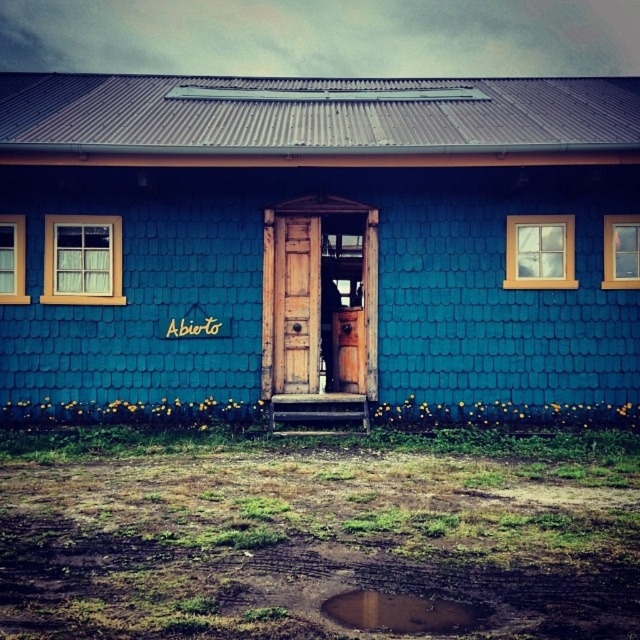
You are standing in front of the rustic building with the vibrant blue shingled exterior. You notice a wooden door at the center. Can you determine if the point at coordinates [324,300] is located on the wooden door at center?

The point at coordinates [324,300] is on the wooden door at center, so yes, the point is located on the wooden door at center.

You are a delivery person trying to enter the building through the wooden door at center. There is a brown mud puddle at lower center in your path. Can you step around it without getting your shoes wet?

The wooden door at center is bigger than the brown mud puddle at lower center, so yes, you can step around the brown mud puddle at lower center and reach the wooden door at center without getting your shoes wet.